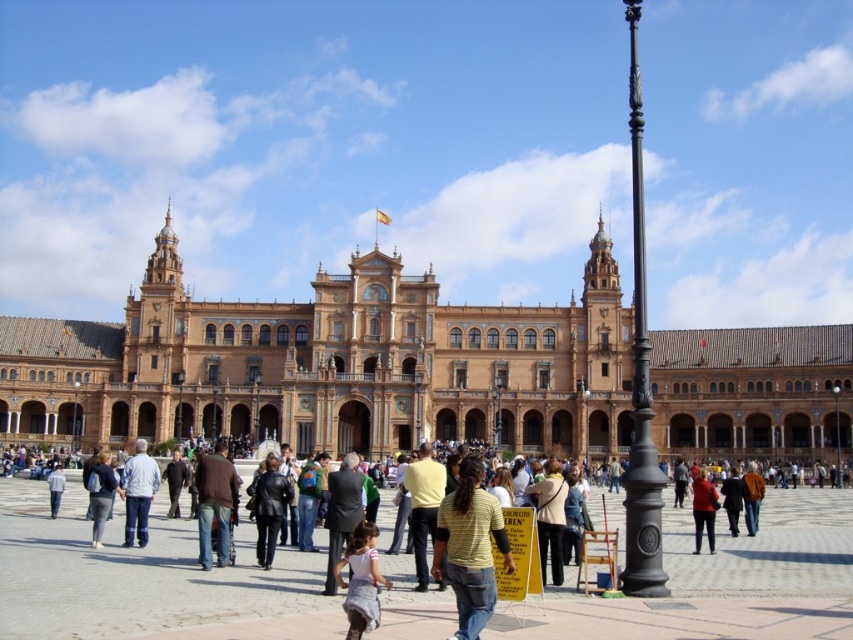
Does brown stone building at center appear under matte concrete plaza at center?

Incorrect, brown stone building at center is not positioned below matte concrete plaza at center.

Can you confirm if brown stone building at center is thinner than matte concrete plaza at center?

Incorrect, brown stone building at center's width is not less than matte concrete plaza at center's.

Describe the element at coordinates (329, 365) in the screenshot. I see `brown stone building at center` at that location.

Where is `brown stone building at center`? brown stone building at center is located at coordinates (329, 365).

Can you confirm if brown leather jacket at center is positioned to the right of black leather jacket at center?

No, brown leather jacket at center is not to the right of black leather jacket at center.

Which is behind, point (202, 525) or point (270, 556)?

Point (202, 525)

Identify the location of brown leather jacket at center. This screenshot has width=853, height=640. (215, 504).

Can you confirm if matte concrete plaza at center is thinner than light brown fabric dress at center?

In fact, matte concrete plaza at center might be wider than light brown fabric dress at center.

Between matte concrete plaza at center and light brown fabric dress at center, which one has less height?

With less height is matte concrete plaza at center.

The image size is (853, 640). What do you see at coordinates (144, 580) in the screenshot? I see `matte concrete plaza at center` at bounding box center [144, 580].

The width and height of the screenshot is (853, 640). I want to click on matte concrete plaza at center, so click(x=144, y=580).